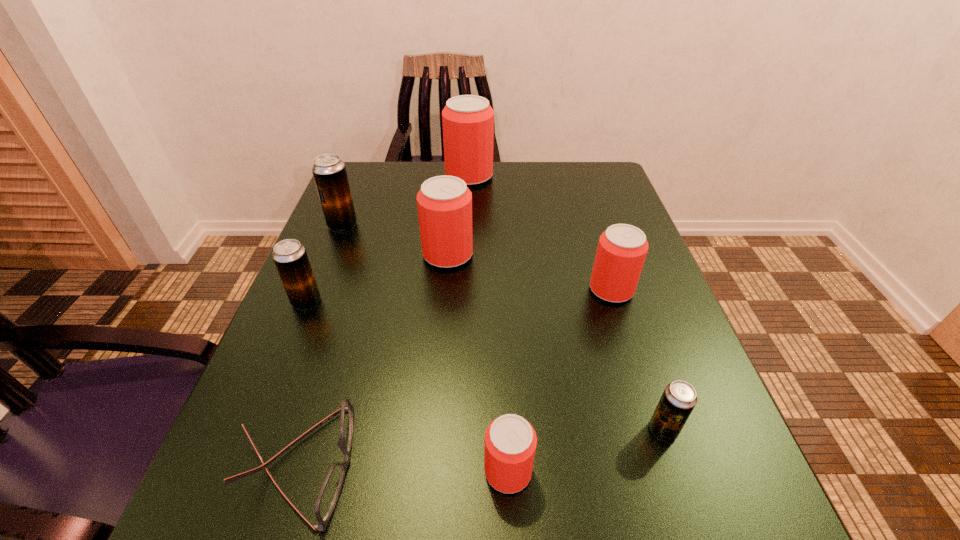
What are the coordinates of `empty space that is in between the second farthest red beer can and the third farthest red beer can` in the screenshot? It's located at (530, 272).

Identify the location of vacant area between the farthest beer can and the second nearest red beer can. (540, 233).

Where is `vacant space that is in between the smallest red beer can and the second biggest red beer can`? The image size is (960, 540). vacant space that is in between the smallest red beer can and the second biggest red beer can is located at coordinates (478, 363).

Locate an element on the screen. The height and width of the screenshot is (540, 960). free spot between the second nearest red beer can and the third smallest red beer can is located at coordinates (530, 272).

This screenshot has width=960, height=540. What are the coordinates of `the second closest object to the smallest black beer can` in the screenshot? It's located at (622, 248).

At what (x,y) coordinates should I click in order to perform the action: click on object that ranks as the seventh closest to the second nearest black beer can. Please return your answer as a coordinate pair (x, y). The height and width of the screenshot is (540, 960). Looking at the image, I should click on (679, 398).

Select which beer can is the fourth closest to the sixth farthest beer can. Please provide its 2D coordinates. Your answer should be formatted as a tuple, i.e. [(x, y)], where the tuple contains the x and y coordinates of a point satisfying the conditions above.

[(290, 257)]

At what (x,y) coordinates should I click in order to perform the action: click on beer can that is the nearest to the second farthest black beer can. Please return your answer as a coordinate pair (x, y). Looking at the image, I should click on (329, 171).

Locate which red beer can ranks fourth in proximity to the sixth nearest beer can. Please provide its 2D coordinates. Your answer should be formatted as a tuple, i.e. [(x, y)], where the tuple contains the x and y coordinates of a point satisfying the conditions above.

[(510, 441)]

Point out which red beer can is positioned as the fourth nearest to the seventh nearest object. Please provide its 2D coordinates. Your answer should be formatted as a tuple, i.e. [(x, y)], where the tuple contains the x and y coordinates of a point satisfying the conditions above.

[(510, 441)]